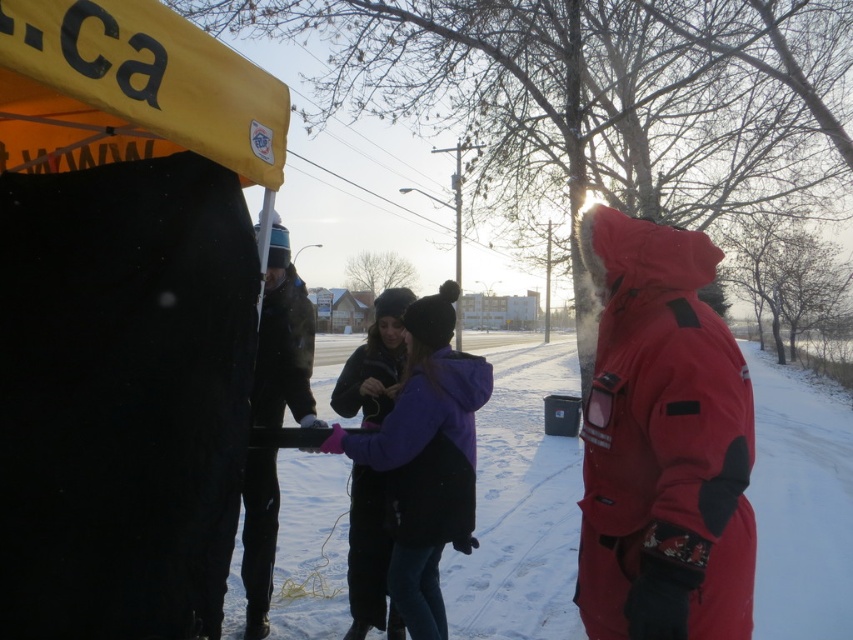
You are standing outside in the winter scene and want to hand a scarf to the person wearing the red synthetic ski jacket at right. Which direction should you walk to reach them first without passing through the dark green fabric jacket at center?

You should walk towards the red synthetic ski jacket at right directly since it is in front of the dark green fabric jacket at center, so you can reach them without needing to go around or through the other person.

From the picture: You are a photographer trying to capture a candid shot of the two people in the scene. The camera you are using has a minimum focusing distance of 24 inches. Can you take a clear photo of both the purple fleece jacket at center and the dark green fabric jacket at center without moving the camera?

The purple fleece jacket at center and the dark green fabric jacket at center are 25.87 inches apart from each other. Since the camera has a minimum focusing distance of 24 inches, the 25.87 inches distance between them is just beyond the minimum requirement. Therefore, the photographer can take a clear photo of both jackets without moving the camera as the distance is sufficient.

You are planning to build a snowman using the white fluffy snow at center and the red synthetic ski jacket at right. Which object is more suitable for constructing the snowman?

The white fluffy snow at center is more suitable for constructing the snowman since it is larger in size than the red synthetic ski jacket at right.